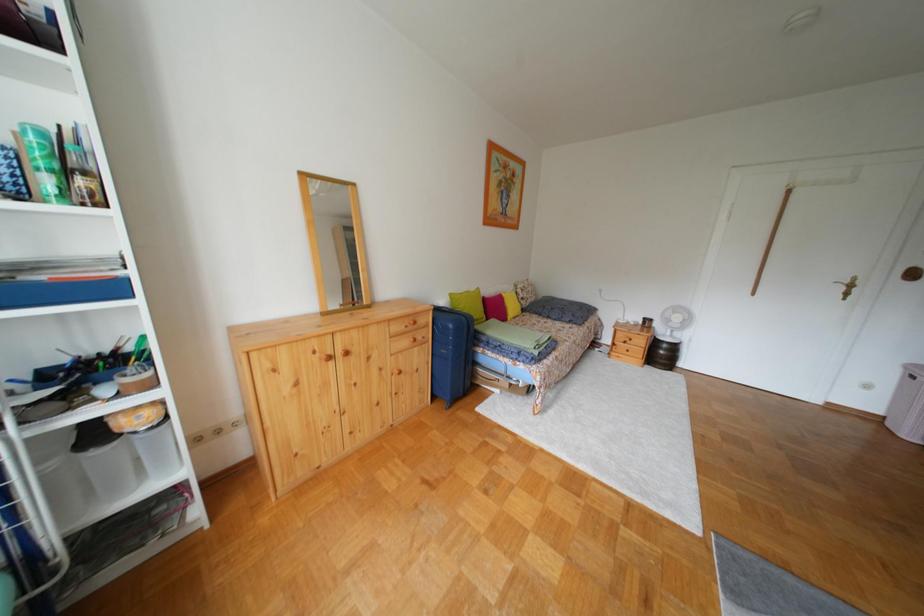
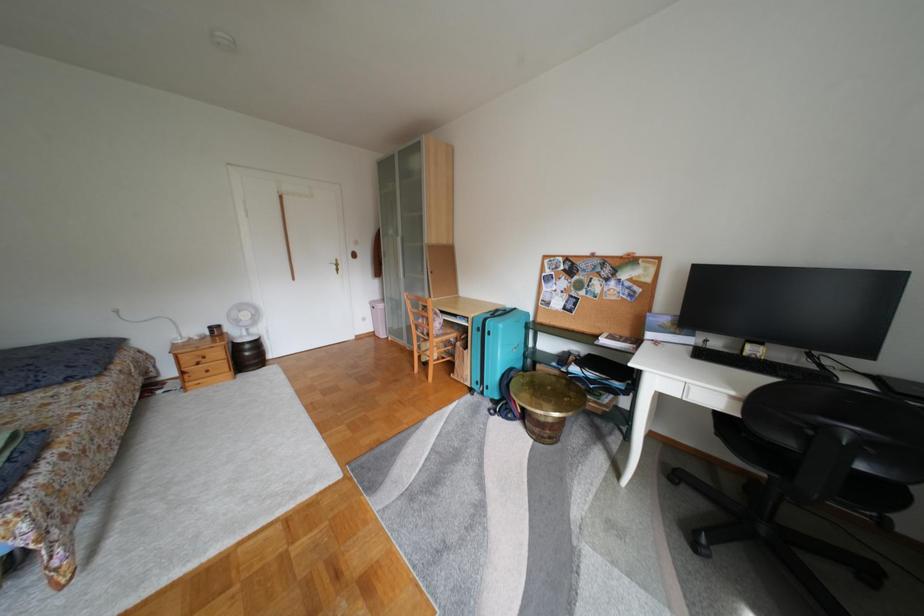
Question: The images are taken continuously from a first-person perspective. In which direction is your viewpoint rotating?

Choices:
 (A) Left
 (B) Right
 (C) Up
 (D) Down

Answer: (B)